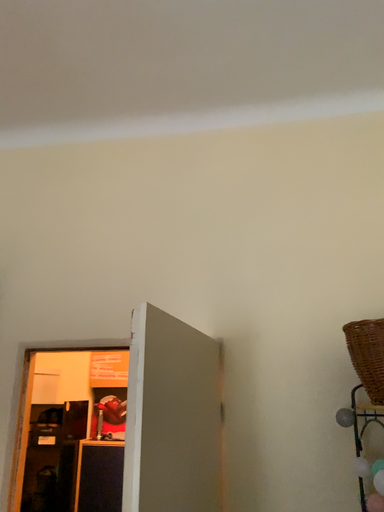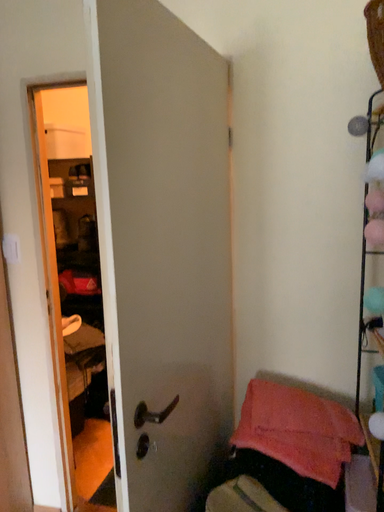
Question: How did the camera likely rotate when shooting the video?

Choices:
 (A) rotated upward
 (B) rotated downward

Answer: (B)